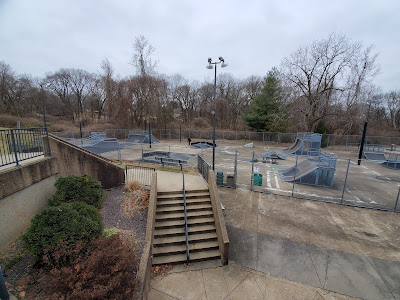
The width and height of the screenshot is (400, 300). I want to click on stairway, so click(170, 218), click(201, 219).